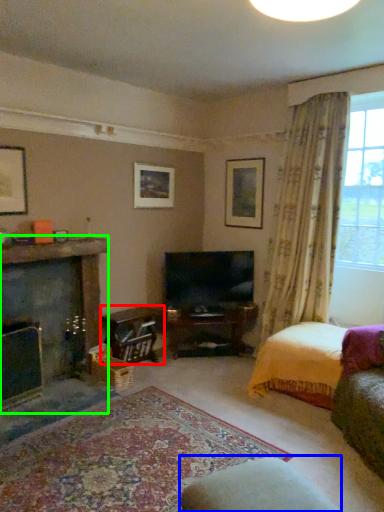
Question: Based on their relative distances, which object is nearer to table (highlighted by a red box)? Choose from rocking chair (highlighted by a blue box) and fireplace (highlighted by a green box).

Choices:
 (A) rocking chair
 (B) fireplace

Answer: (B)